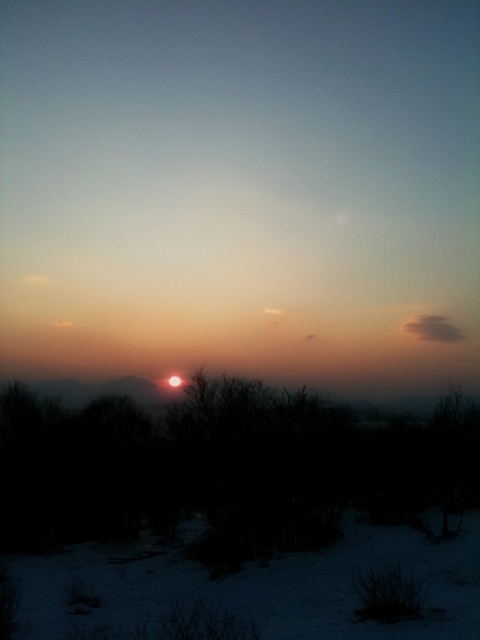
Question: Is silhouette leafless tree at center thinner than white powdery snow at lower center?

Choices:
 (A) no
 (B) yes

Answer: (A)

Question: Which of the following is the farthest from the observer?

Choices:
 (A) (474, 515)
 (B) (406, 484)

Answer: (B)

Question: Does silhouette leafless tree at center come behind white powdery snow at lower center?

Choices:
 (A) no
 (B) yes

Answer: (B)

Question: Can you confirm if silhouette leafless tree at center is positioned to the left of white powdery snow at lower center?

Choices:
 (A) yes
 (B) no

Answer: (A)